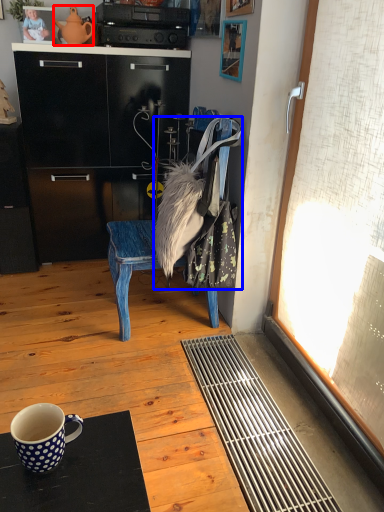
Question: Which of the following is the closest to the observer, teapot (highlighted by a red box) or handbag (highlighted by a blue box)?

Choices:
 (A) teapot
 (B) handbag

Answer: (B)